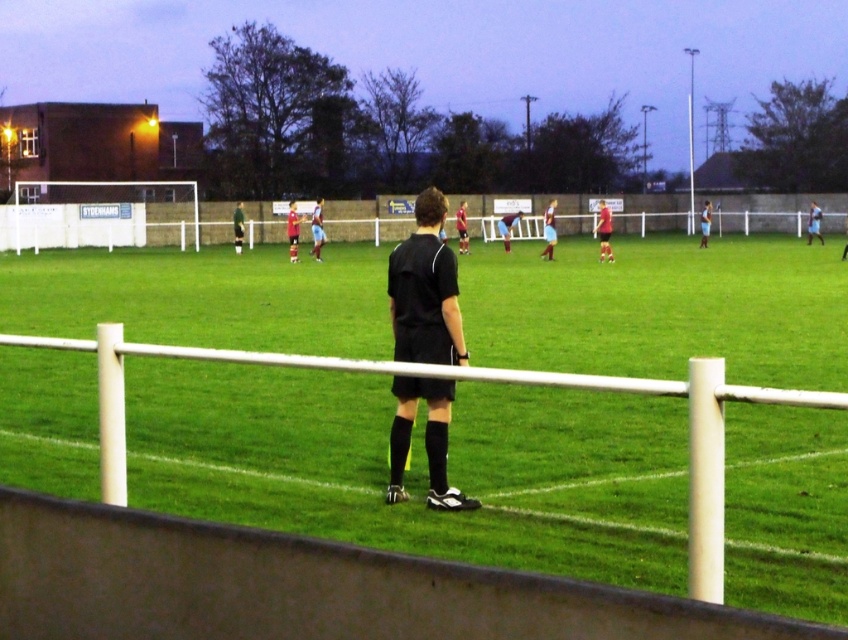
Can you confirm if black matte referee at center is bigger than dark green jersey at center?

Correct, black matte referee at center is larger in size than dark green jersey at center.

Can you confirm if black matte referee at center is wider than dark green jersey at center?

Indeed, black matte referee at center has a greater width compared to dark green jersey at center.

Does point (389, 428) come farther from viewer compared to point (238, 230)?

No, it is in front of (238, 230).

Where is `black matte referee at center`? This screenshot has height=640, width=848. black matte referee at center is located at coordinates (425, 291).

Is the position of matte black shorts at center more distant than that of dark green jersey at center?

No, matte black shorts at center is in front of dark green jersey at center.

Can you confirm if matte black shorts at center is shorter than dark green jersey at center?

No, matte black shorts at center is not shorter than dark green jersey at center.

Find the location of a particular element. matte black shorts at center is located at coordinates (604, 230).

Identify the location of matte black shorts at center. (604, 230).

Between point (756, 493) and point (235, 250), which one is positioned behind?

Point (235, 250)

Is point (300, 404) more distant than point (240, 246)?

No.

Find the location of a particular element. This screenshot has width=848, height=640. green grass football field at center is located at coordinates (417, 467).